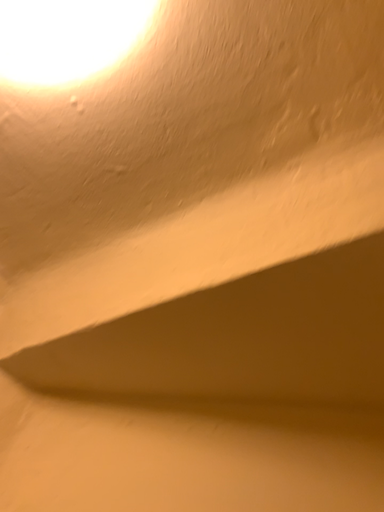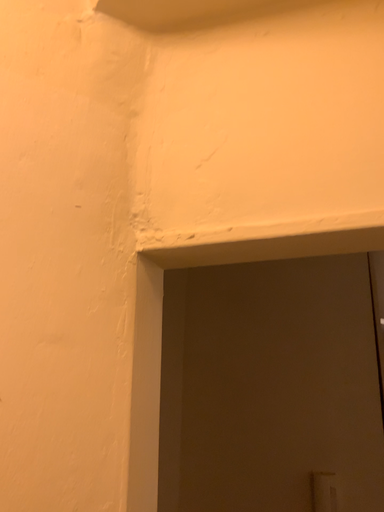
Question: Which way did the camera rotate in the video?

Choices:
 (A) rotated right
 (B) rotated left

Answer: (B)